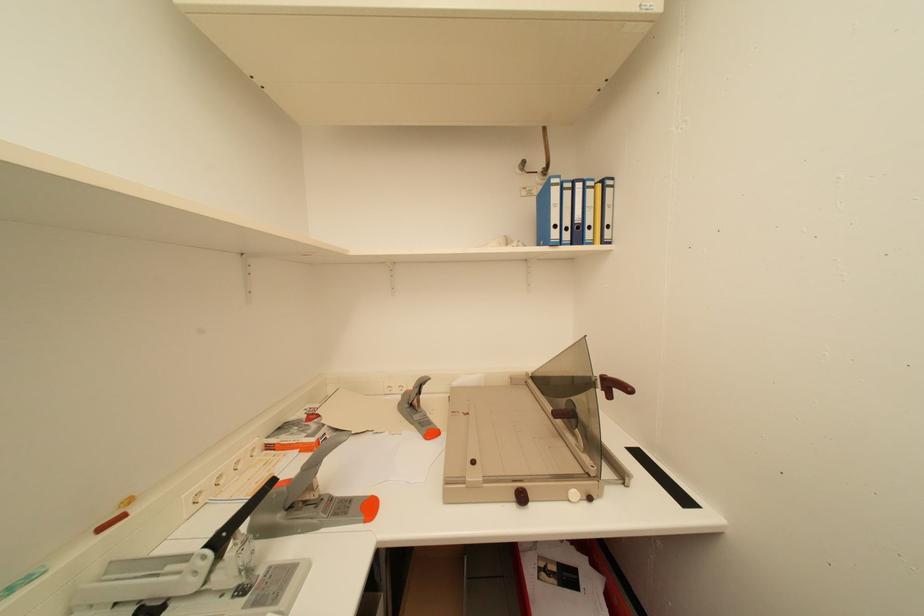
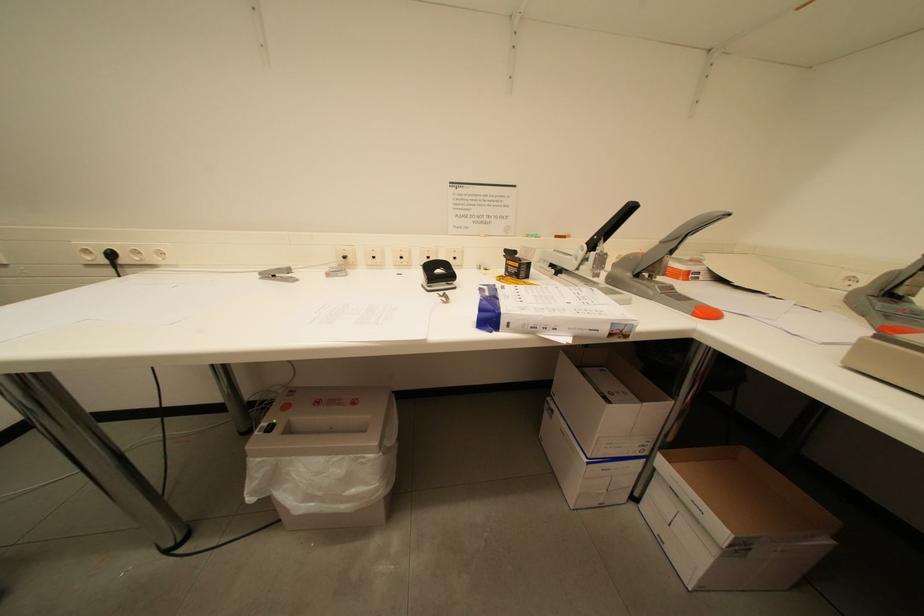
Based on the continuous images, in which direction is the camera rotating?

The rotation direction of the camera is left-down.